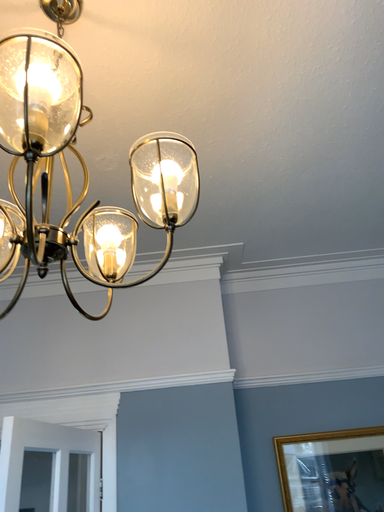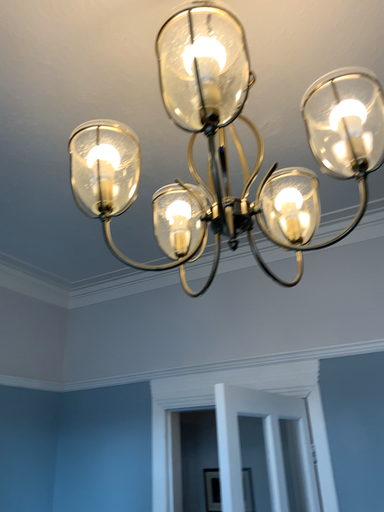
Question: How did the camera likely rotate when shooting the video?

Choices:
 (A) rotated left
 (B) rotated right

Answer: (A)